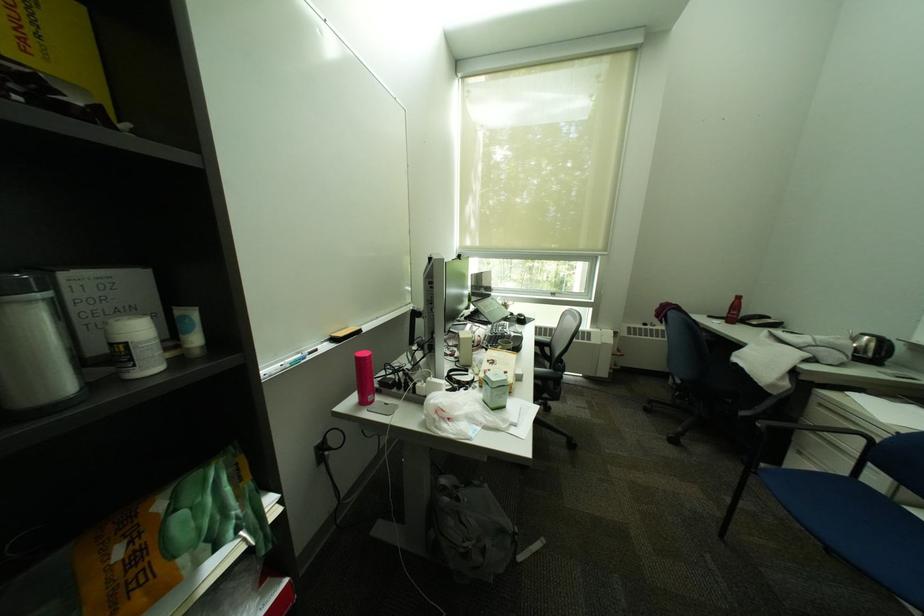
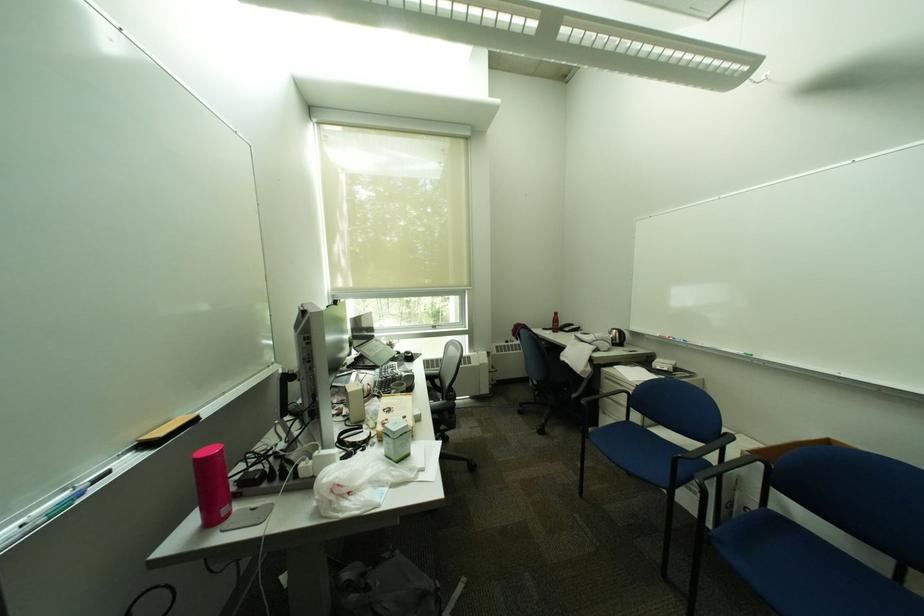
Locate, in the second image, the point that corresponds to the point at 365,360 in the first image.

(202, 464)